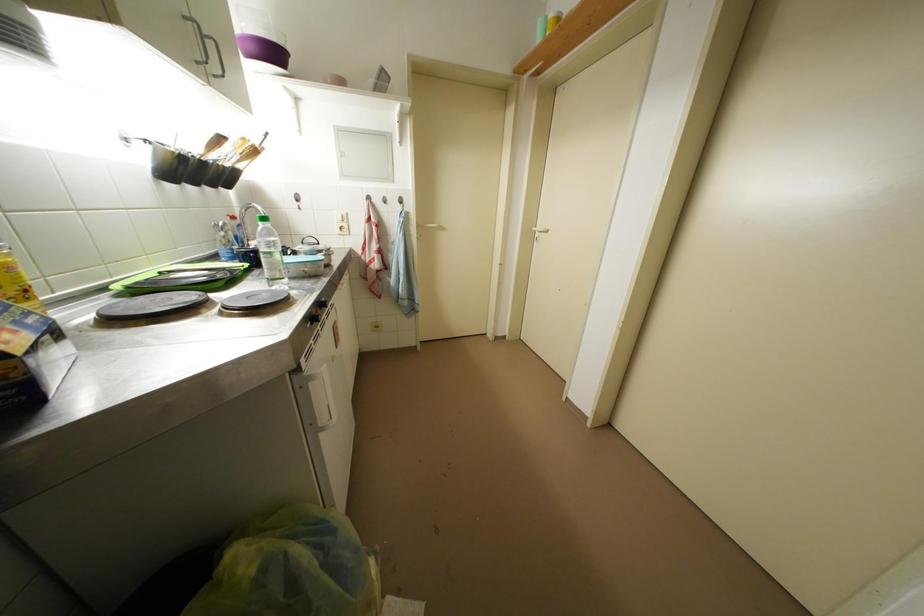
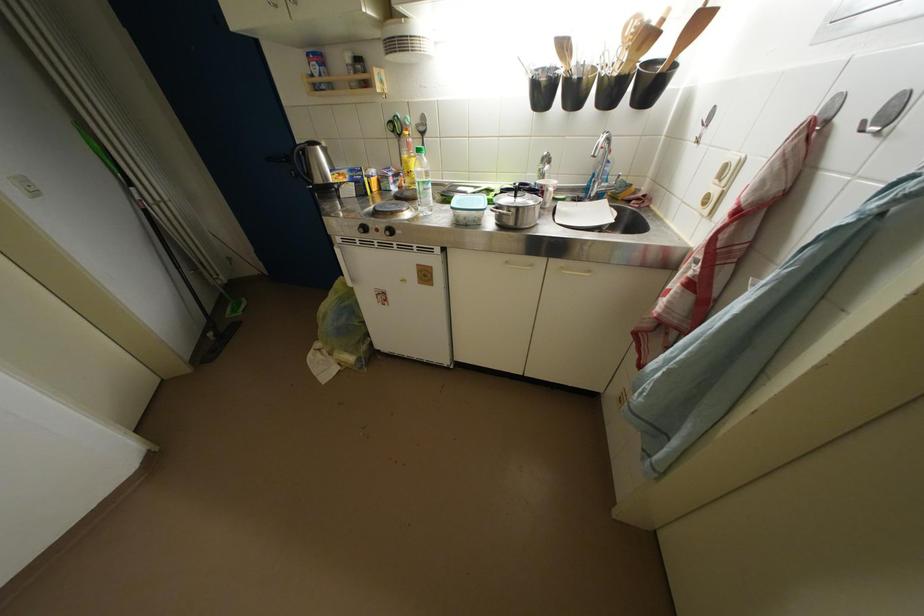
Where in the second image is the point corresponding to point 392,207 from the first image?

(869, 132)